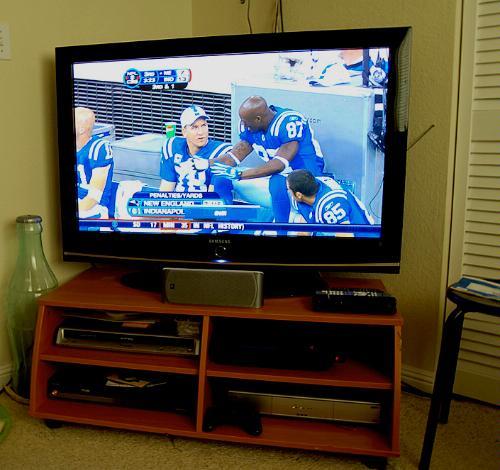
Identify the location of speaker grille. The image size is (500, 470). (220, 292).